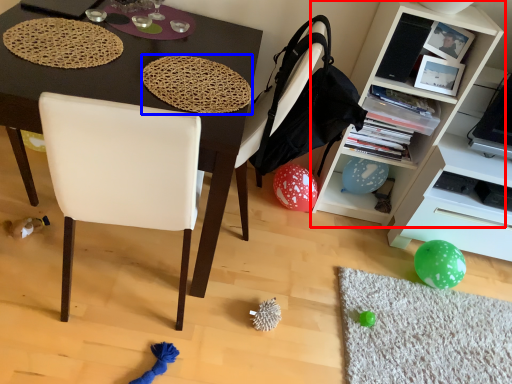
Question: Which object appears closest to the camera in this image, cabinetry (highlighted by a red box) or mat (highlighted by a blue box)?

Choices:
 (A) cabinetry
 (B) mat

Answer: (B)